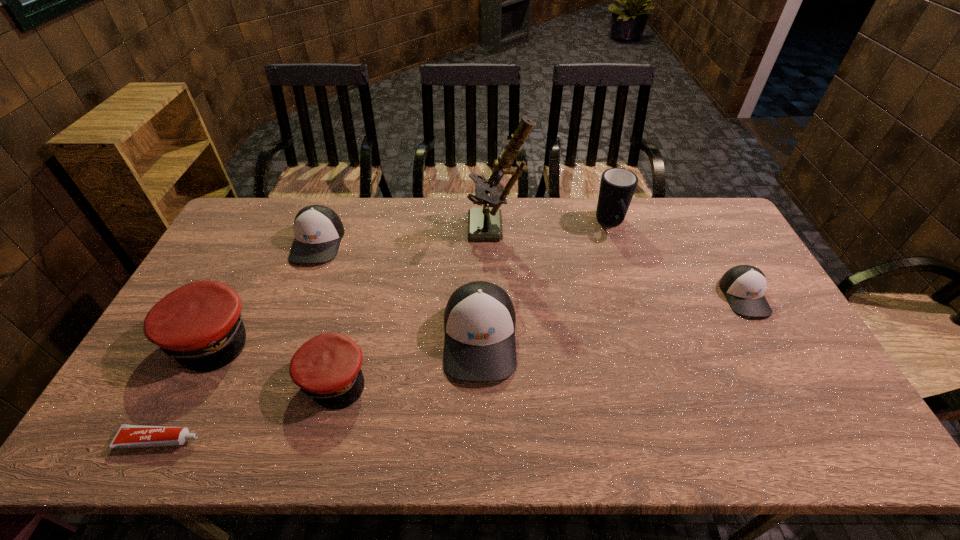
Locate an element on the screen. the tallest object is located at coordinates (484, 224).

You are a GUI agent. You are given a task and a screenshot of the screen. Output one action in this format:
    pyautogui.click(x=<x>, y=<y>)
    Task: Click on the microscope
    
    Given the screenshot: What is the action you would take?
    pyautogui.click(x=484, y=224)

Locate an element on the screen. Image resolution: width=960 pixels, height=540 pixels. mug is located at coordinates (617, 187).

You are a GUI agent. You are given a task and a screenshot of the screen. Output one action in this format:
    pyautogui.click(x=<x>, y=<y>)
    Task: Click on the second object from right to left
    This screenshot has width=960, height=540.
    Given the screenshot: What is the action you would take?
    pyautogui.click(x=617, y=187)

I want to click on the third tallest object, so click(x=479, y=319).

Locate an element on the screen. This screenshot has height=540, width=960. the biggest gray cap is located at coordinates (479, 319).

Image resolution: width=960 pixels, height=540 pixels. I want to click on the farthest gray cap, so click(318, 230).

You are a GUI agent. You are given a task and a screenshot of the screen. Output one action in this format:
    pyautogui.click(x=<x>, y=<y>)
    Task: Click on the second smallest gray cap
    
    Given the screenshot: What is the action you would take?
    pyautogui.click(x=318, y=230)

Where is `the bigger red cap`? the bigger red cap is located at coordinates (199, 325).

The image size is (960, 540). I want to click on the leftmost cap, so click(199, 325).